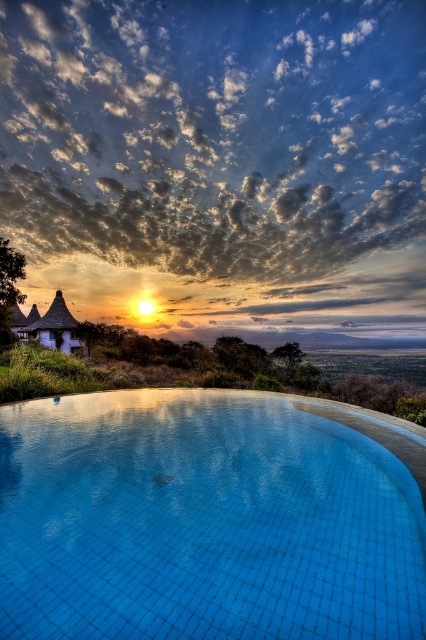
Question: Which of the following is the closest to the observer?

Choices:
 (A) wooden thatched hut at left
 (B) blue tile swimming pool at lower center

Answer: (B)

Question: Which point is closer to the camera?

Choices:
 (A) wooden thatched hut at left
 (B) blue tile swimming pool at lower center

Answer: (B)

Question: Considering the relative positions of blue tile swimming pool at lower center and wooden thatched hut at left in the image provided, where is blue tile swimming pool at lower center located with respect to wooden thatched hut at left?

Choices:
 (A) right
 (B) left

Answer: (A)

Question: Is blue tile swimming pool at lower center closer to camera compared to wooden thatched hut at left?

Choices:
 (A) yes
 (B) no

Answer: (A)

Question: Does blue tile swimming pool at lower center appear on the left side of wooden thatched hut at left?

Choices:
 (A) no
 (B) yes

Answer: (A)